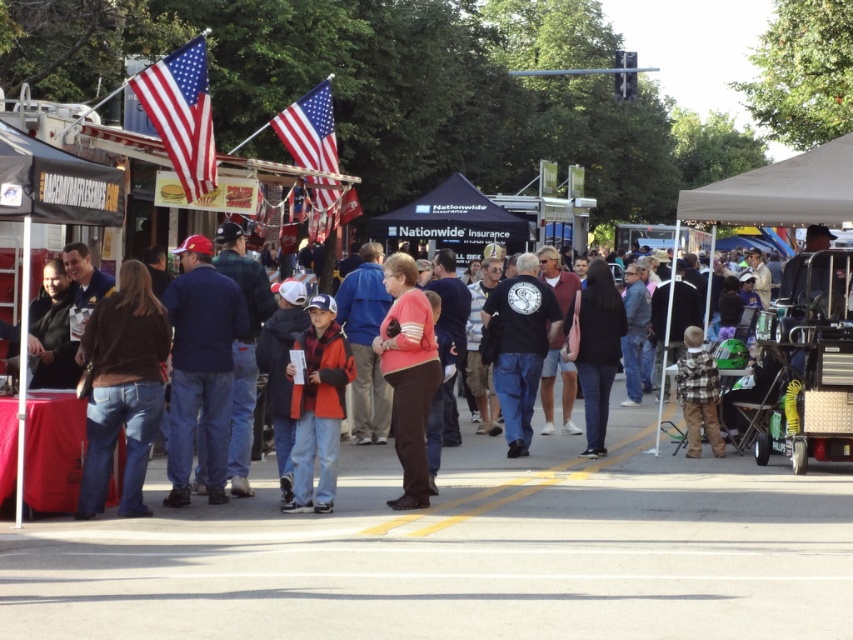
Who is more distant from viewer, (196,168) or (606,324)?

The point (196,168) is behind.

Does red/white/blue fabric flag at upper left have a greater width compared to black matte jacket at center?

Indeed, red/white/blue fabric flag at upper left has a greater width compared to black matte jacket at center.

I want to click on red/white/blue fabric flag at upper left, so click(x=181, y=113).

Image resolution: width=853 pixels, height=640 pixels. Find the location of `red/white/blue fabric flag at upper left`. red/white/blue fabric flag at upper left is located at coordinates point(181,113).

Between orange fleece jacket at center and polished metallic flag at upper center, which one appears on the right side from the viewer's perspective?

Positioned to the right is orange fleece jacket at center.

This screenshot has height=640, width=853. What do you see at coordinates (318, 406) in the screenshot? I see `orange fleece jacket at center` at bounding box center [318, 406].

Which is behind, point (326, 326) or point (315, 180)?

Positioned behind is point (315, 180).

At what (x,y) coordinates should I click in order to perform the action: click on orange fleece jacket at center. Please return your answer as a coordinate pair (x, y). Looking at the image, I should click on (318, 406).

Who is more distant from viewer, (x=846, y=211) or (x=523, y=252)?

Positioned behind is point (x=523, y=252).

Is white fabric canopy at upper right above black cotton t-shirt at center?

Correct, white fabric canopy at upper right is located above black cotton t-shirt at center.

This screenshot has width=853, height=640. What do you see at coordinates (780, 192) in the screenshot?
I see `white fabric canopy at upper right` at bounding box center [780, 192].

The image size is (853, 640). In order to click on white fabric canopy at upper right in this screenshot , I will do `click(780, 192)`.